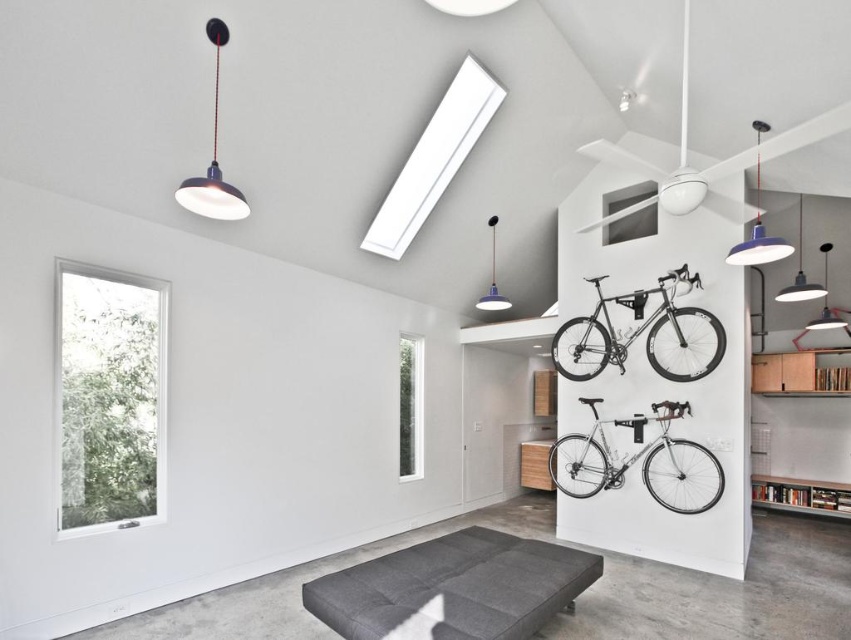
Is dark gray fabric bench at lower center smaller than silver metallic bicycle at lower right?

Correct, dark gray fabric bench at lower center occupies less space than silver metallic bicycle at lower right.

Between point (523, 614) and point (717, 465), which one is positioned behind?

Positioned behind is point (717, 465).

Find the location of a particular element. dark gray fabric bench at lower center is located at coordinates (455, 586).

Can you confirm if silver metallic bicycle at upper right is smaller than silver metallic bicycle at lower right?

Correct, silver metallic bicycle at upper right occupies less space than silver metallic bicycle at lower right.

Who is more distant from viewer, (x=609, y=323) or (x=614, y=484)?

Positioned behind is point (x=609, y=323).

Identify the location of silver metallic bicycle at upper right. (637, 332).

Can you confirm if dark gray fabric bench at lower center is smaller than silver metallic bicycle at upper right?

Yes.

Does dark gray fabric bench at lower center have a greater width compared to silver metallic bicycle at upper right?

Yes.

Locate an element on the screen. The width and height of the screenshot is (851, 640). dark gray fabric bench at lower center is located at coordinates (455, 586).